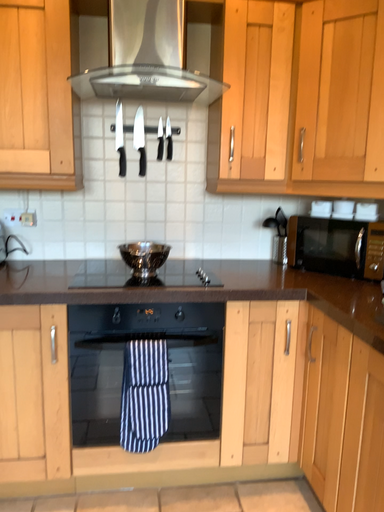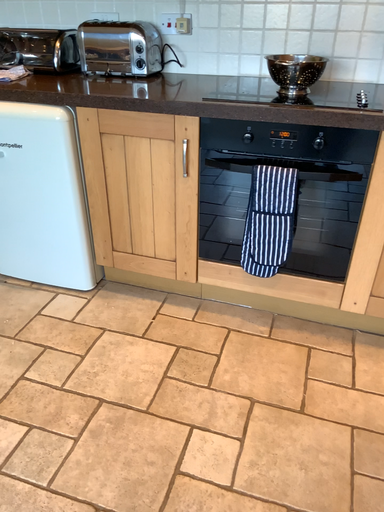
Question: Which way did the camera rotate in the video?

Choices:
 (A) rotated upward
 (B) rotated downward

Answer: (B)